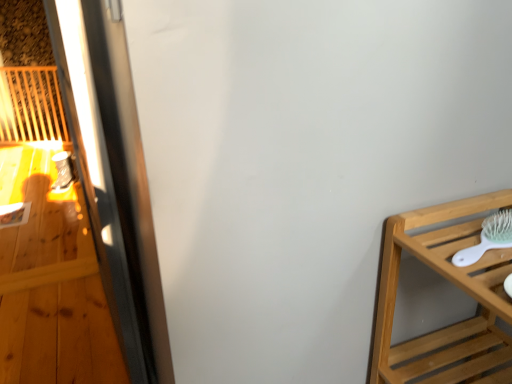
Question: Looking at the image, does metallic screen door at left seem bigger or smaller compared to light brown wooden shelf at right?

Choices:
 (A) big
 (B) small

Answer: (A)

Question: Visually, is metallic screen door at left positioned to the left or to the right of light brown wooden shelf at right?

Choices:
 (A) left
 (B) right

Answer: (A)

Question: Which object is the farthest from the metallic screen door at left?

Choices:
 (A) light brown wooden shelf at right
 (B) white plastic brush at right

Answer: (B)

Question: Based on their relative distances, which object is farther from the metallic screen door at left?

Choices:
 (A) white plastic brush at right
 (B) light brown wooden shelf at right

Answer: (A)